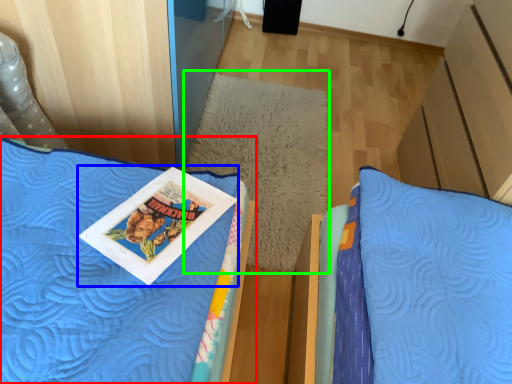
Question: Which object is the closest to the bed (highlighted by a red box)? Choose among these: comic book (highlighted by a blue box) or pillow (highlighted by a green box).

Choices:
 (A) comic book
 (B) pillow

Answer: (A)